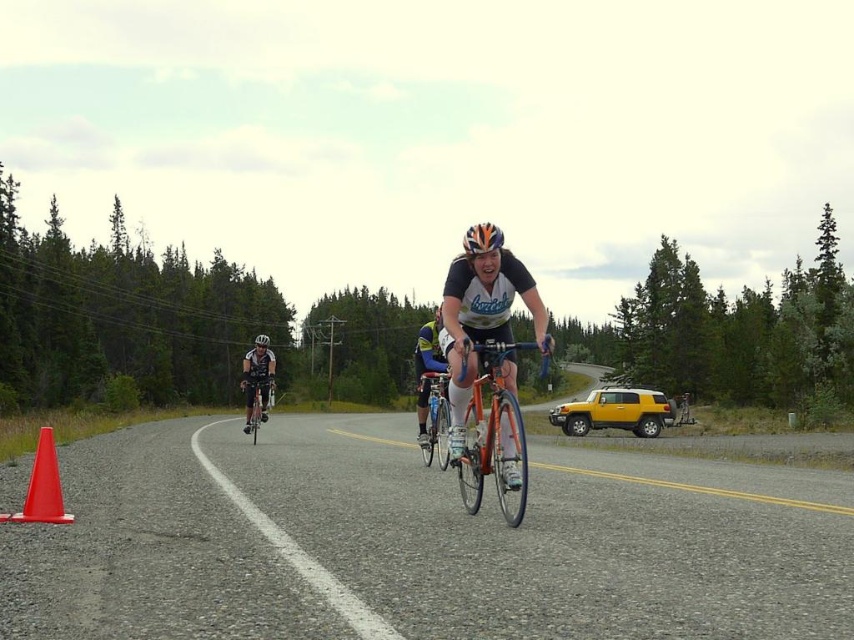
Is the position of yellow matte suv at right less distant than that of shiny black helmet at center?

No, yellow matte suv at right is further to the viewer.

This screenshot has width=854, height=640. What do you see at coordinates (613, 412) in the screenshot?
I see `yellow matte suv at right` at bounding box center [613, 412].

You are a GUI agent. You are given a task and a screenshot of the screen. Output one action in this format:
    pyautogui.click(x=<x>, y=<y>)
    Task: Click on the yellow matte suv at right
    
    Given the screenshot: What is the action you would take?
    pyautogui.click(x=613, y=412)

Does matte black bicycle at center come in front of shiny orange bicycle at center?

That is False.

Which of these two, matte black bicycle at center or shiny orange bicycle at center, stands taller?

matte black bicycle at center

Who is more forward, (469, 369) or (460, 468)?

Point (469, 369)

Image resolution: width=854 pixels, height=640 pixels. Find the location of `matte black bicycle at center`. matte black bicycle at center is located at coordinates (481, 321).

Can you confirm if shiny black helmet at center is taller than white matte bicycle helmet at center?

Yes.

Is shiny black helmet at center positioned at the back of white matte bicycle helmet at center?

No, it is in front of white matte bicycle helmet at center.

Does point (244, 381) lie in front of point (256, 340)?

Yes, it is.

You are a GUI agent. You are given a task and a screenshot of the screen. Output one action in this format:
    pyautogui.click(x=<x>, y=<y>)
    Task: Click on the shiny black helmet at center
    The image size is (854, 640).
    Given the screenshot: What is the action you would take?
    pyautogui.click(x=256, y=378)